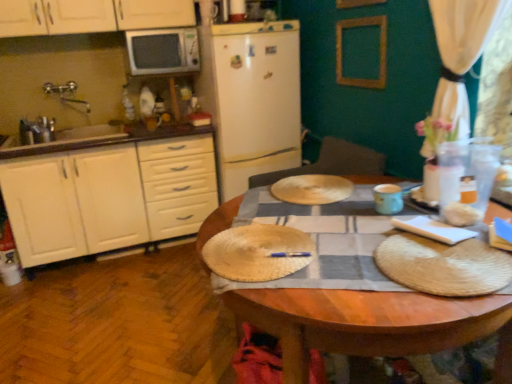
I want to click on spots to the right of matte blue cup at center right, so click(x=420, y=207).